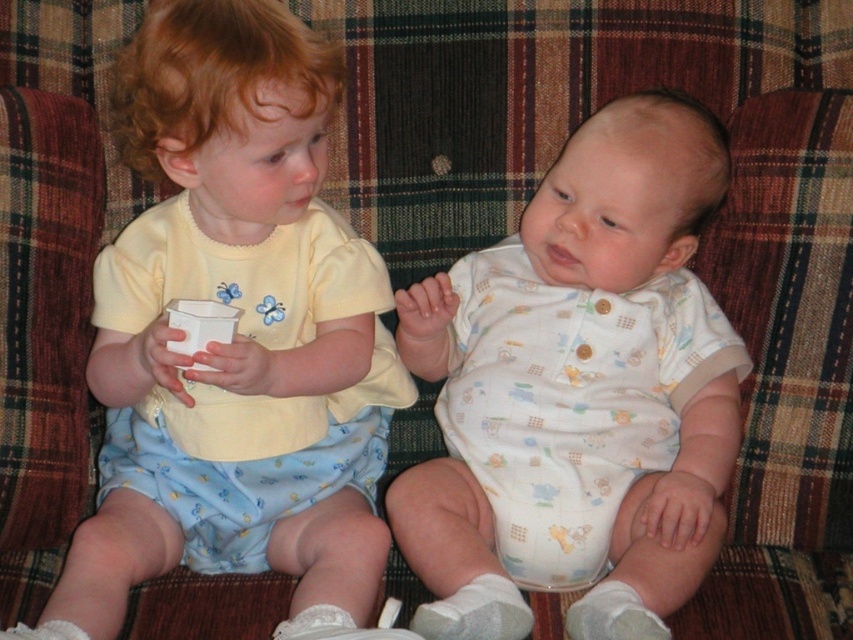
Question: Among these points, which one is farthest from the camera?

Choices:
 (A) (155, 388)
 (B) (601, 540)

Answer: (A)

Question: Is yellow cotton shirt at left below white cotton onesie at center?

Choices:
 (A) yes
 (B) no

Answer: (B)

Question: Which object is farther from the camera taking this photo?

Choices:
 (A) white cotton onesie at center
 (B) yellow cotton shirt at left

Answer: (A)

Question: Is yellow cotton shirt at left wider than white cotton onesie at center?

Choices:
 (A) yes
 (B) no

Answer: (B)

Question: From the image, what is the correct spatial relationship of yellow cotton shirt at left in relation to white cotton onesie at center?

Choices:
 (A) above
 (B) below

Answer: (A)